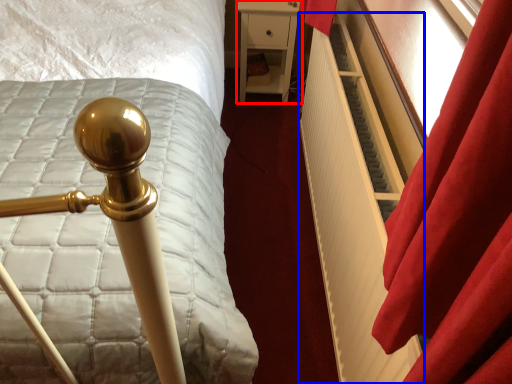
Question: Which object is further to the camera taking this photo, furniture (highlighted by a red box) or radiator (highlighted by a blue box)?

Choices:
 (A) furniture
 (B) radiator

Answer: (A)